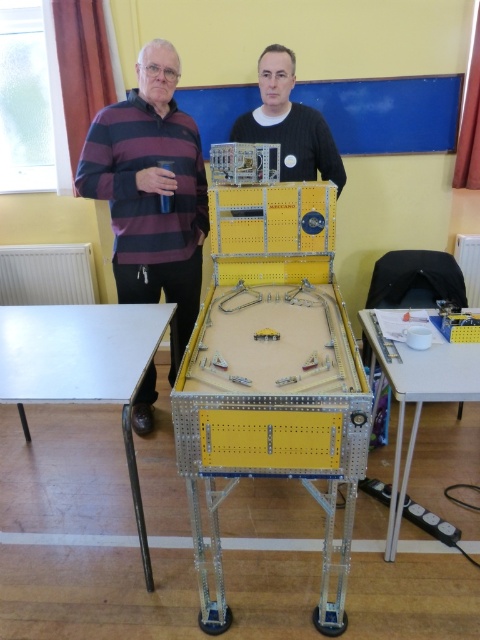
Question: Which point is farther to the camera?

Choices:
 (A) (177, 180)
 (B) (468, 396)
 (C) (44, 387)
 (D) (280, 72)

Answer: (D)

Question: Which of the following is the farthest from the observer?

Choices:
 (A) (264, 97)
 (B) (83, 314)

Answer: (A)

Question: Estimate the real-world distances between objects in this image. Which object is closer to the striped cotton sweater at upper left?

Choices:
 (A) striped sweater at left
 (B) white plastic table at lower right
 (C) black matte shirt at center

Answer: (A)

Question: Does striped cotton sweater at upper left have a lesser width compared to black matte shirt at center?

Choices:
 (A) no
 (B) yes

Answer: (B)

Question: Does striped cotton sweater at upper left appear under white matte table at lower left?

Choices:
 (A) yes
 (B) no

Answer: (B)

Question: Does white matte table at lower left appear on the right side of white plastic table at lower right?

Choices:
 (A) no
 (B) yes

Answer: (A)